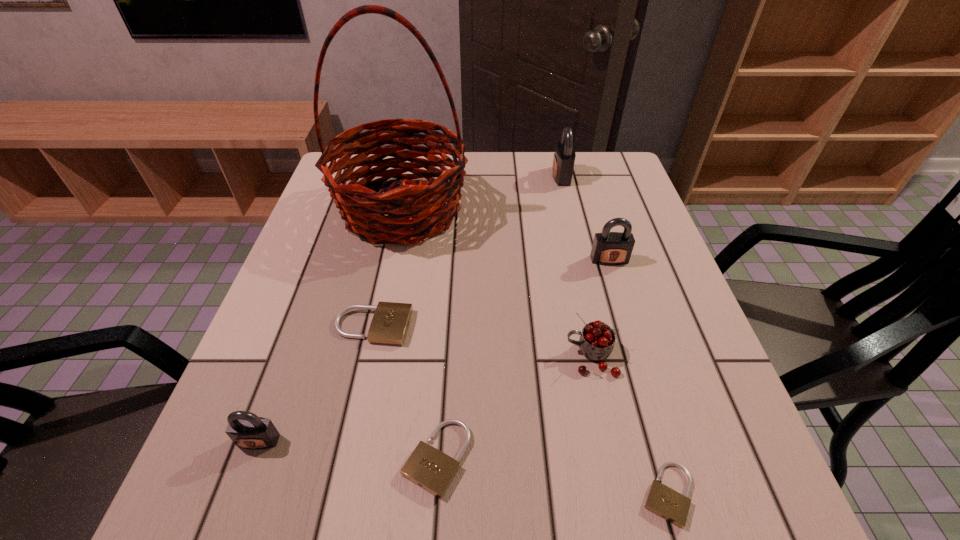
This screenshot has width=960, height=540. In order to click on the tallest object in this screenshot , I will do `click(423, 201)`.

Identify the location of the farthest padlock. (564, 157).

The height and width of the screenshot is (540, 960). What are the coordinates of `the tallest padlock` in the screenshot? It's located at (564, 157).

I want to click on the second farthest gray padlock, so click(609, 248).

The width and height of the screenshot is (960, 540). In order to click on the second smallest gray padlock in this screenshot , I will do `click(609, 248)`.

At what (x,y) coordinates should I click in order to perform the action: click on red cherry. Please return your answer as a coordinate pair (x, y). Looking at the image, I should click on pos(597,339).

Locate an element on the screen. Image resolution: width=960 pixels, height=540 pixels. the leftmost padlock is located at coordinates (247, 430).

At what (x,y) coordinates should I click in order to perform the action: click on the smallest gray padlock. Please return your answer as a coordinate pair (x, y). The image size is (960, 540). Looking at the image, I should click on (247, 430).

Where is `the leftmost beige padlock`? The image size is (960, 540). the leftmost beige padlock is located at coordinates (390, 322).

In order to click on the farthest beige padlock in this screenshot , I will do `click(390, 322)`.